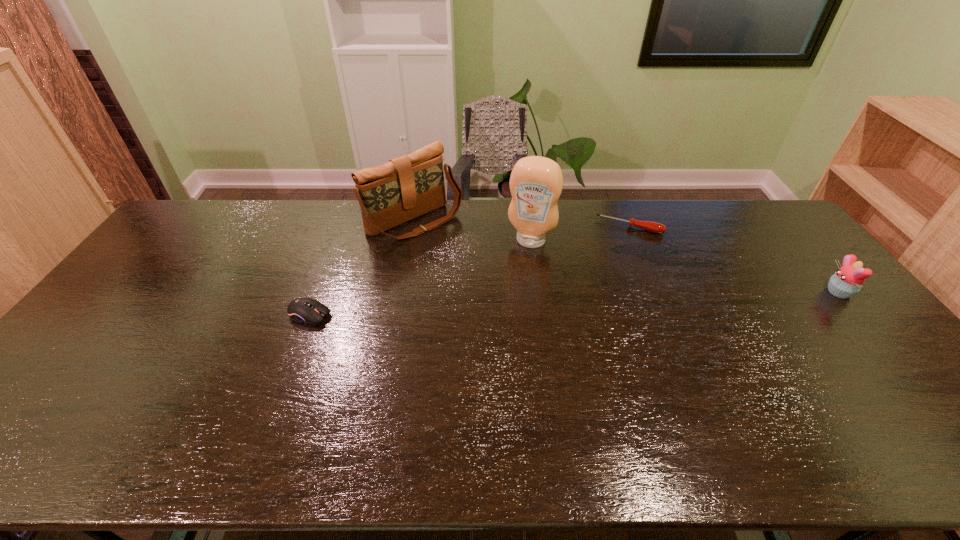
Locate an element on the screen. free space at the right edge of the desktop is located at coordinates (763, 248).

What are the coordinates of `free location at the far right corner of the desktop` in the screenshot? It's located at (772, 217).

Locate an element on the screen. free space between the third object from left to right and the second shortest object is located at coordinates (420, 278).

The height and width of the screenshot is (540, 960). In order to click on vacant area between the rightmost object and the screwdriver in this screenshot , I will do `click(734, 259)`.

You are a GUI agent. You are given a task and a screenshot of the screen. Output one action in this format:
    pyautogui.click(x=<x>, y=<y>)
    Task: Click on the empty space that is in between the cupcake and the tallest object
    
    Given the screenshot: What is the action you would take?
    pyautogui.click(x=684, y=266)

The image size is (960, 540). Find the location of `vacant space in between the rightmost object and the third object from left to right`. vacant space in between the rightmost object and the third object from left to right is located at coordinates (684, 266).

Find the location of `free space between the computer mouse and the screwdriver`. free space between the computer mouse and the screwdriver is located at coordinates (469, 271).

You are a GUI agent. You are given a task and a screenshot of the screen. Output one action in this format:
    pyautogui.click(x=<x>, y=<y>)
    Task: Click on the empty location between the condiment and the fourth tallest object
    
    Given the screenshot: What is the action you would take?
    pyautogui.click(x=420, y=278)

Where is `free point between the second object from left to right and the third shortest object`? free point between the second object from left to right and the third shortest object is located at coordinates [x=627, y=256].

At what (x,y) coordinates should I click in order to perform the action: click on free spot between the second shortest object and the screwdriver. Please return your answer as a coordinate pair (x, y). Looking at the image, I should click on (469, 271).